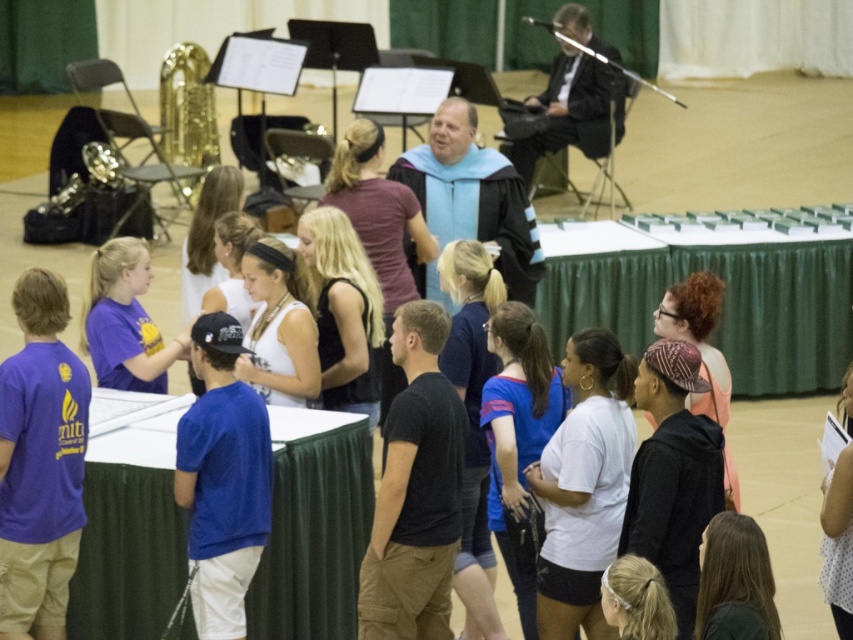
Does black suit at upper right appear on the left side of gold brass saxophone at upper left?

In fact, black suit at upper right is to the right of gold brass saxophone at upper left.

Who is taller, black suit at upper right or gold brass saxophone at upper left?

black suit at upper right

Measure the distance between point (561, 108) and camera.

Point (561, 108) is 18.54 meters away from camera.

Image resolution: width=853 pixels, height=640 pixels. What are the coordinates of `black suit at upper right` in the screenshot? It's located at (572, 112).

The width and height of the screenshot is (853, 640). I want to click on light blue fabric graduation gown at center, so click(x=473, y=195).

Does light blue fabric graduation gown at center have a larger size compared to gold brass saxophone at upper left?

No.

Locate an element on the screen. light blue fabric graduation gown at center is located at coordinates [473, 195].

Locate an element on the screen. Image resolution: width=853 pixels, height=640 pixels. light blue fabric graduation gown at center is located at coordinates (473, 195).

Does light blue fabric graduation gown at center appear under black suit at upper right?

Indeed, light blue fabric graduation gown at center is positioned under black suit at upper right.

Is point (526, 218) positioned after point (605, 93)?

No.

Which is behind, point (432, 285) or point (537, 157)?

The point (537, 157) is behind.

Where is `light blue fabric graduation gown at center`? The width and height of the screenshot is (853, 640). light blue fabric graduation gown at center is located at coordinates pos(473,195).